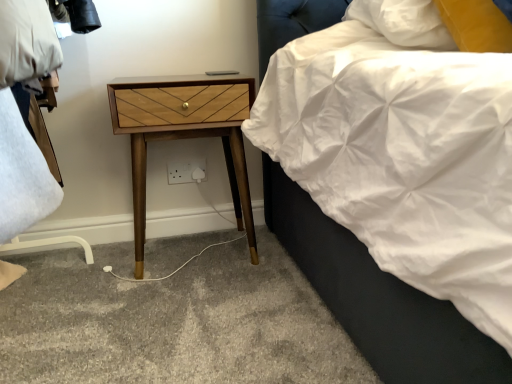
At what (x,y) coordinates should I click in order to perform the action: click on woodenmaterial/texturenightstand at left. Please return your answer as a coordinate pair (x, y). The height and width of the screenshot is (384, 512). Looking at the image, I should click on (184, 134).

In order to face woodenmaterial/texturenightstand at left, should I rotate leftwards or rightwards?

A 9.076 degree turn to the left will do.

Describe the element at coordinates (184, 134) in the screenshot. The height and width of the screenshot is (384, 512). I see `woodenmaterial/texturenightstand at left` at that location.

Measure the distance between point (175, 169) and camera.

Point (175, 169) and camera are 1.58 meters apart from each other.

This screenshot has height=384, width=512. Describe the element at coordinates (186, 171) in the screenshot. I see `white plastic electric outlet at lower center` at that location.

You are a GUI agent. You are given a task and a screenshot of the screen. Output one action in this format:
    pyautogui.click(x=<x>, y=<y>)
    Task: Click on the white plastic electric outlet at lower center
    
    Given the screenshot: What is the action you would take?
    pyautogui.click(x=186, y=171)

Image resolution: width=512 pixels, height=384 pixels. Find the location of `woodenmaterial/texturenightstand at left`. woodenmaterial/texturenightstand at left is located at coordinates (184, 134).

Is white plastic electric outlet at lower center to the right of woodenmaterial/texturenightstand at left from the viewer's perspective?

Incorrect, white plastic electric outlet at lower center is not on the right side of woodenmaterial/texturenightstand at left.

Considering the relative positions of white plastic electric outlet at lower center and woodenmaterial/texturenightstand at left in the image provided, is white plastic electric outlet at lower center behind woodenmaterial/texturenightstand at left?

Yes, it is behind woodenmaterial/texturenightstand at left.

Considering the points (169, 177) and (210, 82), which point is in front, point (169, 177) or point (210, 82)?

The point (210, 82) is more forward.

From the image's perspective, is white plastic electric outlet at lower center above or below woodenmaterial/texturenightstand at left?

Clearly, from the image's perspective, white plastic electric outlet at lower center is below woodenmaterial/texturenightstand at left.

From a real-world perspective, is white plastic electric outlet at lower center on woodenmaterial/texturenightstand at left?

No.

Which object is wider, white plastic electric outlet at lower center or woodenmaterial/texturenightstand at left?

woodenmaterial/texturenightstand at left.

Is white plastic electric outlet at lower center taller or shorter than woodenmaterial/texturenightstand at left?

Considering their sizes, white plastic electric outlet at lower center has less height than woodenmaterial/texturenightstand at left.

In terms of size, does white plastic electric outlet at lower center appear bigger or smaller than woodenmaterial/texturenightstand at left?

In the image, white plastic electric outlet at lower center appears to be smaller than woodenmaterial/texturenightstand at left.

Do you think white plastic electric outlet at lower center is within woodenmaterial/texturenightstand at left, or outside of it?

white plastic electric outlet at lower center is located beyond the bounds of woodenmaterial/texturenightstand at left.

Would you say white plastic electric outlet at lower center is a long distance from woodenmaterial/texturenightstand at left?

No, white plastic electric outlet at lower center is in close proximity to woodenmaterial/texturenightstand at left.

Is white plastic electric outlet at lower center facing away from woodenmaterial/texturenightstand at left?

No, white plastic electric outlet at lower center is not facing away from woodenmaterial/texturenightstand at left.

What's the angular difference between white plastic electric outlet at lower center and woodenmaterial/texturenightstand at left's facing directions?

0.771 degrees.

Could you measure the distance between white plastic electric outlet at lower center and woodenmaterial/texturenightstand at left?

white plastic electric outlet at lower center is 11.22 inches away from woodenmaterial/texturenightstand at left.

Find the location of a particular element. nightstand above the white plastic electric outlet at lower center (from the image's perspective) is located at coordinates (184, 134).

Which is more to the right, woodenmaterial/texturenightstand at left or white plastic electric outlet at lower center?

From the viewer's perspective, woodenmaterial/texturenightstand at left appears more on the right side.

Consider the image. Which object is further away from the camera, woodenmaterial/texturenightstand at left or white plastic electric outlet at lower center?

white plastic electric outlet at lower center is further away from the camera.

Between point (169, 96) and point (178, 177), which one is positioned behind?

The point (178, 177) is behind.

Based on the photo, from the image's perspective, is woodenmaterial/texturenightstand at left located above or below white plastic electric outlet at lower center?

woodenmaterial/texturenightstand at left is situated higher than white plastic electric outlet at lower center in the image.

From a real-world perspective, which is physically above, woodenmaterial/texturenightstand at left or white plastic electric outlet at lower center?

woodenmaterial/texturenightstand at left.

Is woodenmaterial/texturenightstand at left wider or thinner than white plastic electric outlet at lower center?

woodenmaterial/texturenightstand at left is wider than white plastic electric outlet at lower center.

Can you confirm if woodenmaterial/texturenightstand at left is shorter than white plastic electric outlet at lower center?

In fact, woodenmaterial/texturenightstand at left may be taller than white plastic electric outlet at lower center.

Is woodenmaterial/texturenightstand at left bigger or smaller than white plastic electric outlet at lower center?

In the image, woodenmaterial/texturenightstand at left appears to be larger than white plastic electric outlet at lower center.

Is white plastic electric outlet at lower center completely or partially inside woodenmaterial/texturenightstand at left?

No, white plastic electric outlet at lower center is located outside of woodenmaterial/texturenightstand at left.

Is there a large distance between woodenmaterial/texturenightstand at left and white plastic electric outlet at lower center?

They are positioned close to each other.

Is woodenmaterial/texturenightstand at left looking in the opposite direction of white plastic electric outlet at lower center?

Absolutely, woodenmaterial/texturenightstand at left is directed away from white plastic electric outlet at lower center.

Measure the distance between woodenmaterial/texturenightstand at left and white plastic electric outlet at lower center.

They are 11.22 inches apart.

Find the location of a particular element. The width and height of the screenshot is (512, 384). electric outlet below the woodenmaterial/texturenightstand at left (from a real-world perspective) is located at coordinates (186, 171).

Identify the location of nightstand that appears above the white plastic electric outlet at lower center (from a real-world perspective). (184, 134).

This screenshot has height=384, width=512. Identify the location of nightstand on the right of the white plastic electric outlet at lower center. (184, 134).